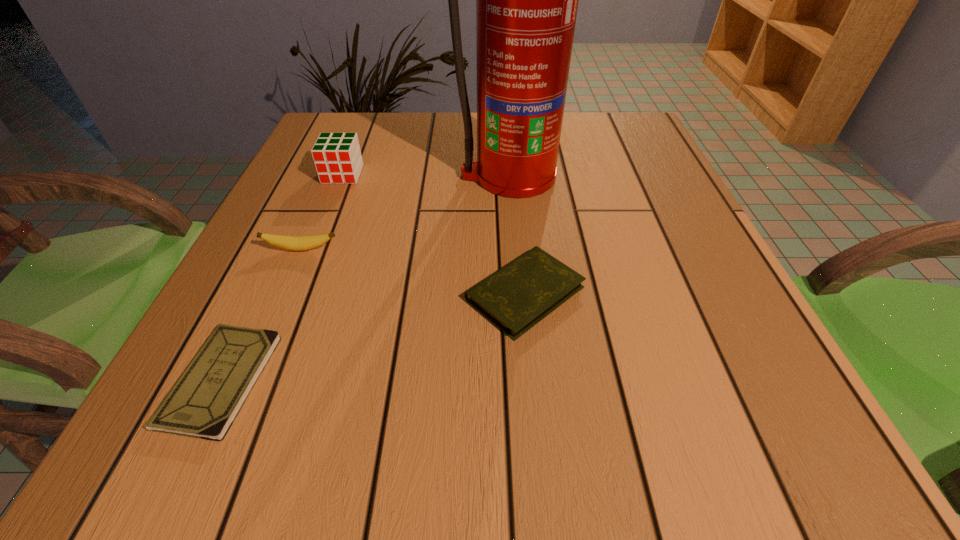
The width and height of the screenshot is (960, 540). I want to click on object at the far edge, so click(x=526, y=0).

The height and width of the screenshot is (540, 960). In order to click on object located in the near edge section of the desktop in this screenshot , I will do `click(203, 403)`.

Identify the location of cube present at the left edge. The image size is (960, 540). (337, 157).

At what (x,y) coordinates should I click in order to perform the action: click on banana that is at the left edge. Please return your answer as a coordinate pair (x, y). Looking at the image, I should click on (297, 243).

This screenshot has width=960, height=540. What are the coordinates of `checkbook present at the left edge` in the screenshot? It's located at (203, 403).

At what (x,y) coordinates should I click in order to perform the action: click on object present at the near left corner. Please return your answer as a coordinate pair (x, y). This screenshot has width=960, height=540. Looking at the image, I should click on (203, 403).

Identify the location of free space at the far edge of the desktop. (570, 151).

Locate an element on the screen. The width and height of the screenshot is (960, 540). vacant region at the near edge of the desktop is located at coordinates (371, 450).

Where is `vacant space at the left edge of the desktop`? This screenshot has width=960, height=540. vacant space at the left edge of the desktop is located at coordinates (298, 160).

Identify the location of vacant space at the right edge. The height and width of the screenshot is (540, 960). (734, 287).